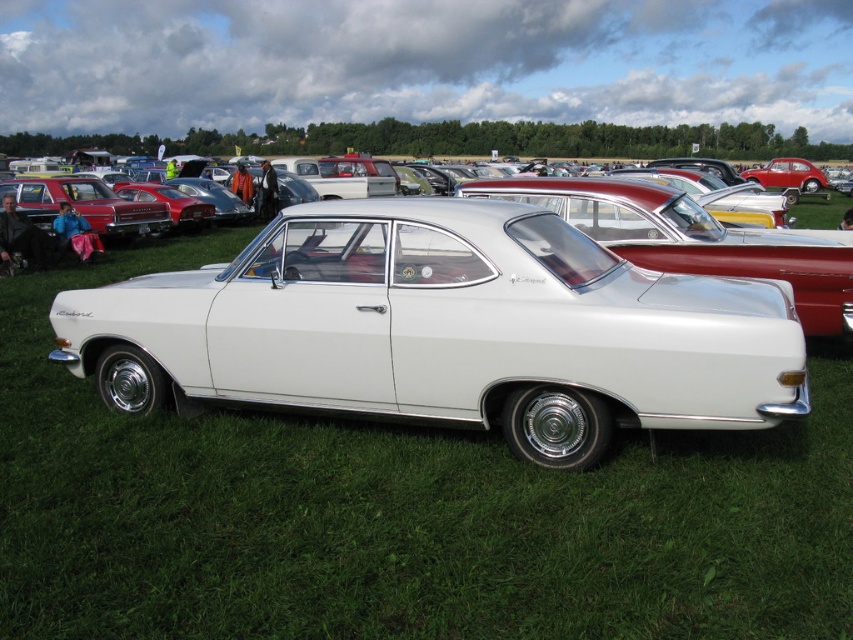
You are standing in front of the white Opel Rekord at the classic car exhibition. You notice two points marked on the car. The first point is at coordinate point (689, 280) and the second is at point (767, 275). If you want to touch the point that is nearer to you, which coordinate should you aim for?

You should aim for point (689, 280) because it is closer to the camera than point (767, 275).

You are a photographer at the classic car exhibition. You want to take a photo of both the white glossy car at center and the white glossy sedan at center. Which one should you focus on first if you want to capture them in the correct left to right order as seen from the front?

You should focus on the white glossy car at center first because it is positioned on the left side of the white glossy sedan at center, so capturing them from left to right would start with the white glossy car at center followed by the white glossy sedan at center.